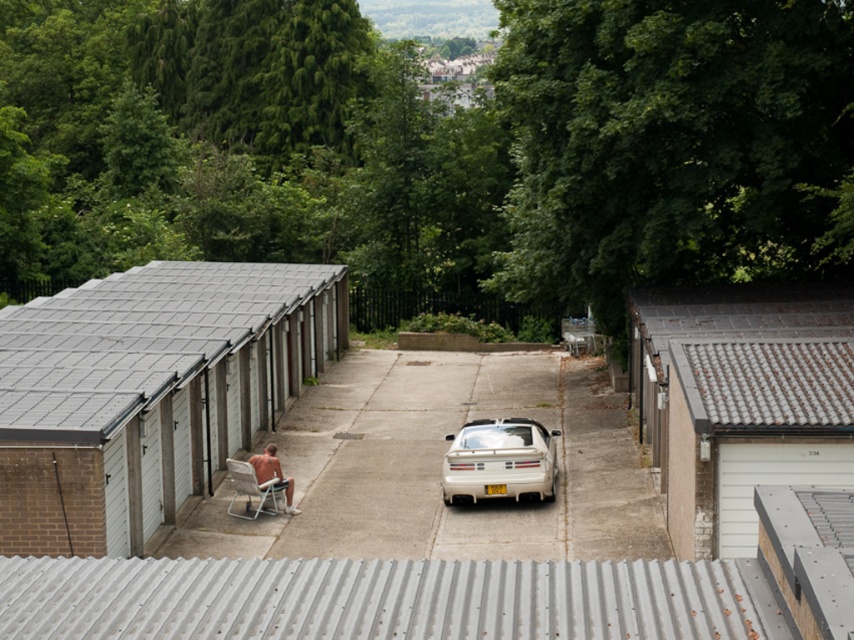
You are a delivery person trying to access the white glossy car at center, which is partially blocked by the white matte shed at left. Can you reach the car without moving the shed?

The white matte shed at left is positioned over the white glossy car at center, so the shed is blocking the car. You cannot reach the car without moving the shed.

You are planning to install a new security camera on the white matte shed at left. The camera requires a mounting height of at least 2 meters. Can the shed accommodate this requirement based on its height compared to the white glossy car at center?

The white matte shed at left is taller than the white glossy car at center. Since the car is a standard vehicle, it is likely under 2 meters in height, so the shed being taller would likely meet the camera mounting requirement.

You are standing in the outdoor scene and want to move from the nude skin at lower left to the gray tile roof at upper right. Which direction should you walk to get there?

To move from the nude skin at lower left to the gray tile roof at upper right, you should walk towards the right since the gray tile roof at upper right is located to the right of the nude skin at lower left.